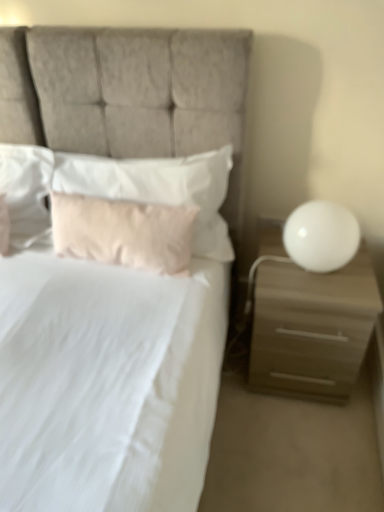
The image size is (384, 512). Identify the location of blank space above matte beige nightstand at right (from a real-world perspective). (319, 278).